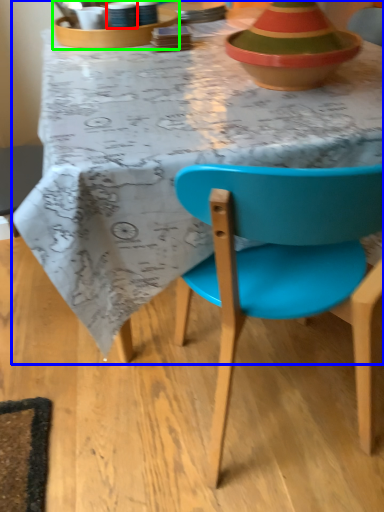
Question: Estimate the real-world distances between objects in this image. Which object is farther from tableware (highlighted by a red box), desk (highlighted by a blue box) or tableware (highlighted by a green box)?

Choices:
 (A) desk
 (B) tableware

Answer: (A)